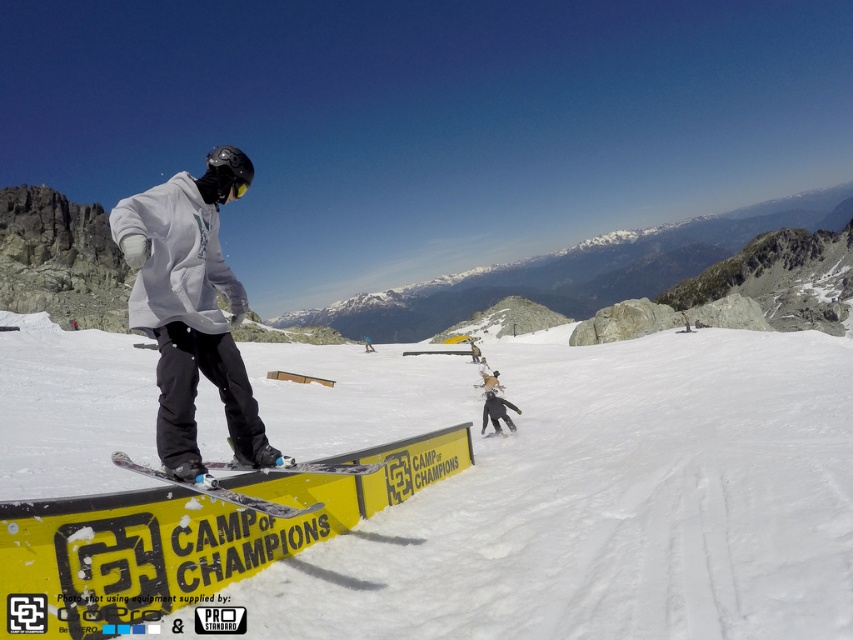
You are a photographer at the snowboarding event. You want to capture a photo of the white matte snowboarder at center and the white matte snow at center in the same frame. Based on their positions, which object should you focus on first to ensure both are in the frame?

Since the white matte snow at center is to the left of the white matte snowboarder at center, you should focus on the white matte snowboarder at center first to ensure both are in the frame.

You are a snowboarder at the event and want to reach the point marked at coordinates point (62, 436). If your maximum jump distance is 200 feet, can you reach it in one jump?

The distance of point (62, 436) from viewer is 199.63 feet, so yes, you can reach it in one jump since it is within your maximum jump distance of 200 feet.